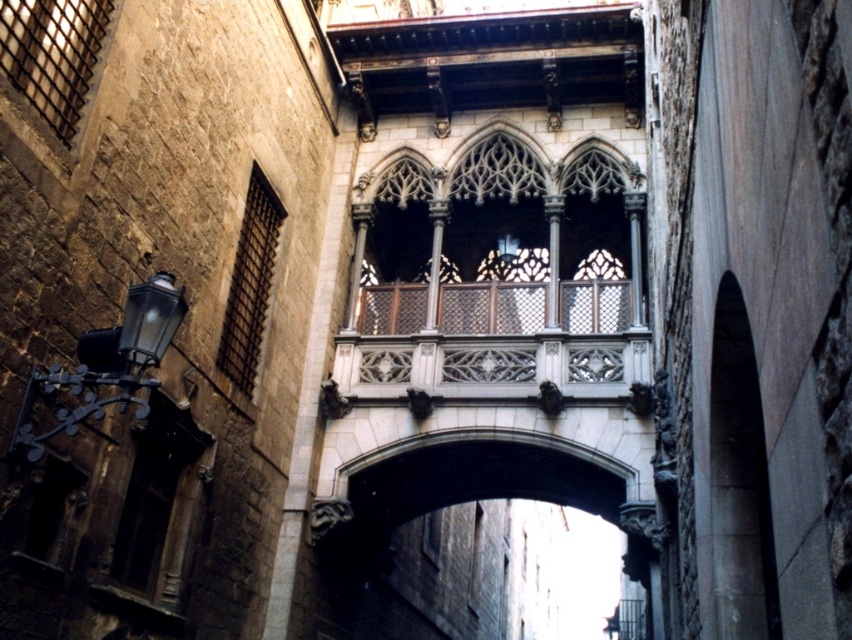
Is white stone balcony at center smaller than smooth stone archway at center?

Indeed, white stone balcony at center has a smaller size compared to smooth stone archway at center.

Is the position of white stone balcony at center more distant than that of smooth stone archway at center?

Yes.

Between point (556, 168) and point (522, 477), which one is positioned in front?

Point (556, 168)

Locate an element on the screen. white stone balcony at center is located at coordinates tap(498, 273).